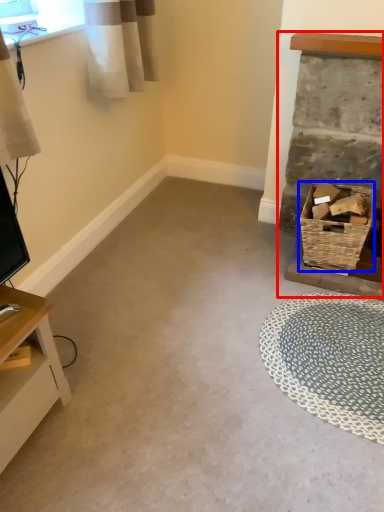
Question: Which point is further to the camera, fireplace (highlighted by a red box) or basket (highlighted by a blue box)?

Choices:
 (A) fireplace
 (B) basket

Answer: (B)